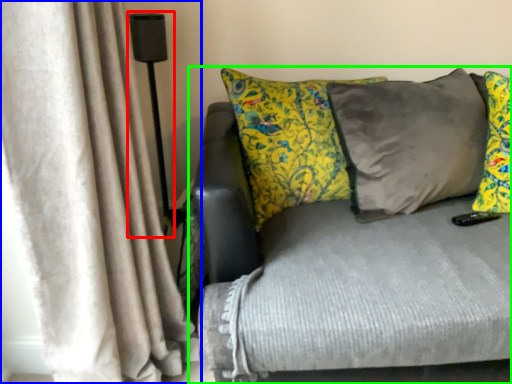
Question: Which object is the closest to the lamp (highlighted by a red box)? Choose among these: curtain (highlighted by a blue box) or studio couch (highlighted by a green box).

Choices:
 (A) curtain
 (B) studio couch

Answer: (A)